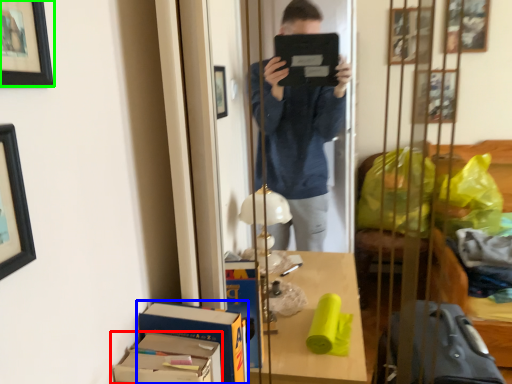
Question: Which object is positioned closest to cardboard box (highlighted by a red box)? Select from cardboard box (highlighted by a blue box) and picture frame (highlighted by a green box).

Choices:
 (A) cardboard box
 (B) picture frame

Answer: (A)